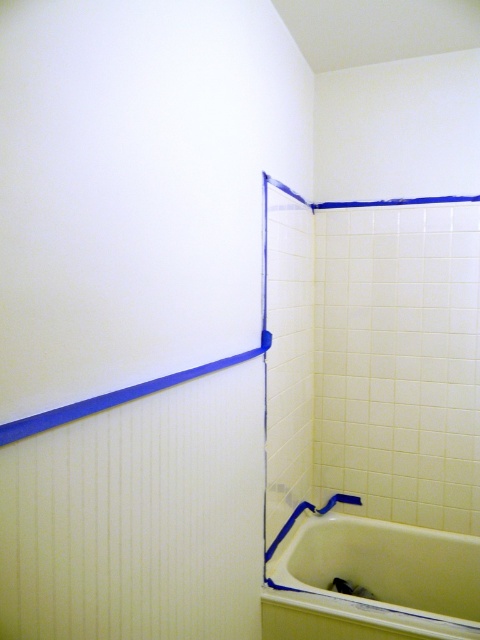
Question: Observing the image, what is the correct spatial positioning of white glossy bathtub at lower right in reference to blue tape at upper center?

Choices:
 (A) left
 (B) right

Answer: (B)

Question: Does white glossy bathtub at lower right lie behind blue tape at upper center?

Choices:
 (A) no
 (B) yes

Answer: (B)

Question: Which of the following is the farthest from the observer?

Choices:
 (A) (27, 429)
 (B) (343, 561)

Answer: (B)

Question: Does white glossy bathtub at lower right appear under blue tape at upper center?

Choices:
 (A) no
 (B) yes

Answer: (B)

Question: Among these points, which one is farthest from the camera?

Choices:
 (A) (50, 419)
 (B) (278, 636)

Answer: (B)